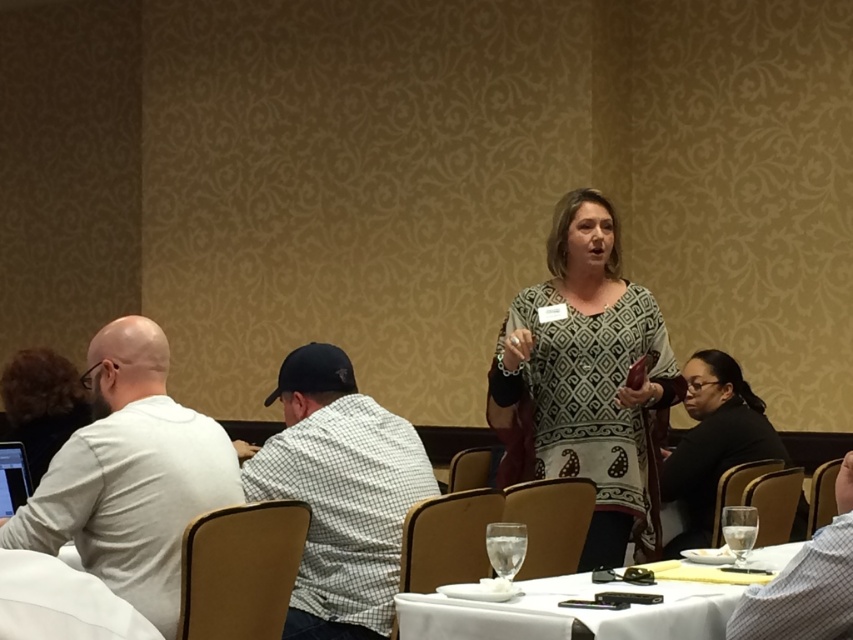
You are a photographer at the event and need to capture a photo of the white matte shirt at left and the clear glass at table center. Which object is located to the left of the other?

The white matte shirt at left is positioned on the left side of the clear glass at table center, so the white matte shirt at left is to the left of the clear glass at table center.

You are attending a formal conference and want to move from the back of the room to the front. There are two points marked in the scene, point A at coordinates point (x=387, y=563) and point B at coordinates point (x=720, y=432). Which point should you aim for to reach the front of the room more quickly?

Point A at coordinates point (x=387, y=563) is closer to the viewer, so aiming for point A would allow you to reach the front of the room more quickly since it is nearer.

You are a photographer at the event. You need to capture a photo of the white matte shirt at left without the clear glass at table center appearing in the foreground. Is this possible based on their positions?

The white matte shirt at left is located above the clear glass at table center, so yes, you can capture the white matte shirt at left without the clear glass at table center in the foreground by angling the camera upwards to avoid the glass.